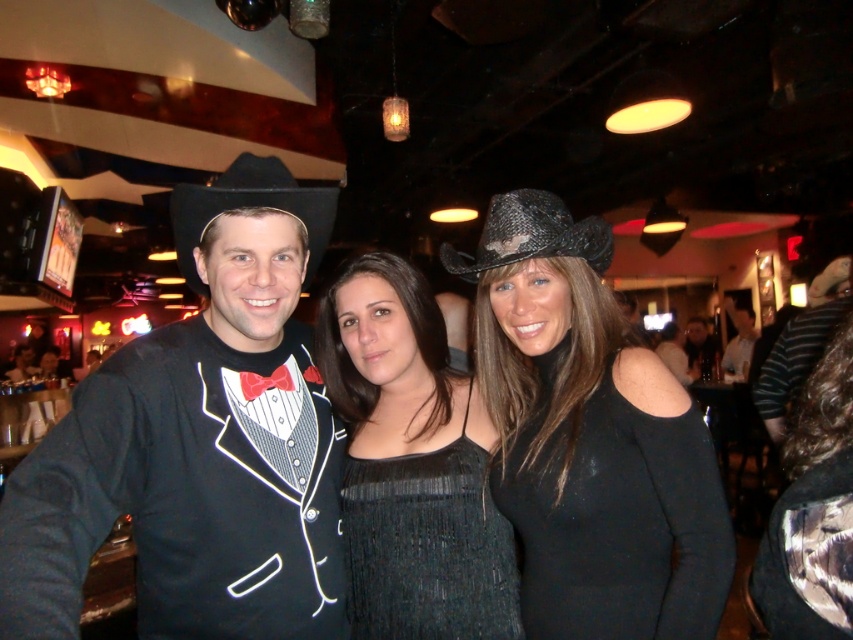
You are a photographer adjusting your camera settings to focus on the black felt fedora at left and the black woven hat at center. Which hat should you adjust your focus on first if you want to ensure both are in sharp detail?

You should focus on the black felt fedora at left first because it is closer to the viewer than the black woven hat at center, allowing you to adjust depth of field starting from the nearest object.

In the scene shown: You are a photographer standing at the back of the room. You want to take a photo of both the black felt fedora at left and the black textured hat at center. Can you capture both in a single frame without moving your position? Explain why or why not.

The distance between the black felt fedora at left and the black textured hat at center is 3.45 meters. Since the photographer is stationary, whether they can fit both into the frame depends on the camera lens. A wide angle lens could potentially capture both, but a standard or telephoto lens might not. However, the question doesn